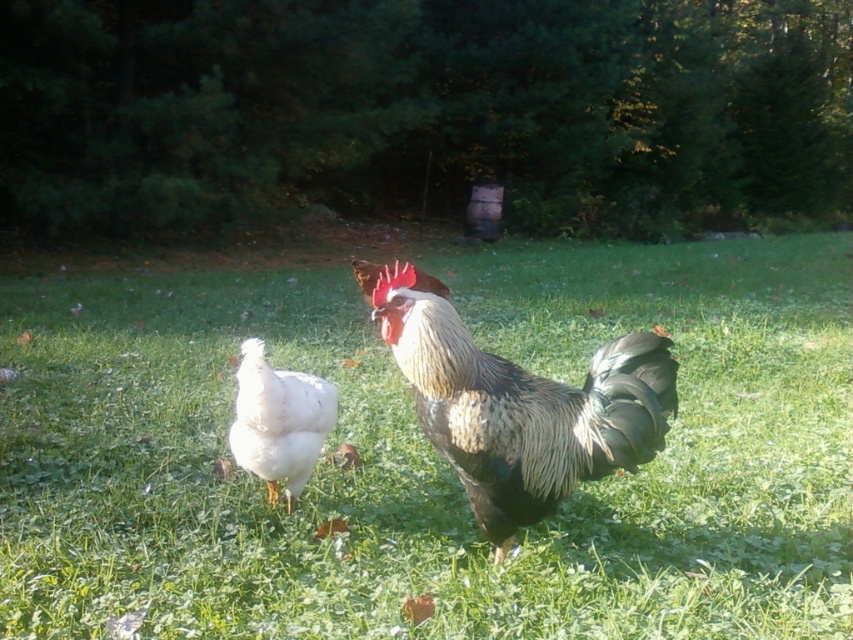
Does green grassy at center appear over black and white feathered rooster at center?

Incorrect, green grassy at center is not positioned above black and white feathered rooster at center.

Can you confirm if green grassy at center is bigger than black and white feathered rooster at center?

No, green grassy at center is not bigger than black and white feathered rooster at center.

What do you see at coordinates (428, 454) in the screenshot? I see `green grassy at center` at bounding box center [428, 454].

Locate an element on the screen. green grassy at center is located at coordinates (428, 454).

Between green grassy at center and white feathered chicken at center, which one is positioned lower?

Positioned lower is green grassy at center.

Is point (805, 440) closer to viewer compared to point (277, 464)?

That is False.

Between point (833, 269) and point (303, 483), which one is positioned in front?

Point (303, 483)

You are a GUI agent. You are given a task and a screenshot of the screen. Output one action in this format:
    pyautogui.click(x=<x>, y=<y>)
    Task: Click on the green grassy at center
    This screenshot has height=640, width=853.
    Given the screenshot: What is the action you would take?
    pyautogui.click(x=428, y=454)

Between black and white feathered rooster at center and white feathered chicken at center, which one appears on the left side from the viewer's perspective?

Positioned to the left is white feathered chicken at center.

Consider the image. Measure the distance between black and white feathered rooster at center and camera.

The distance of black and white feathered rooster at center from camera is 5.11 feet.

Is point (561, 426) closer to camera compared to point (250, 420)?

Yes, it is.

This screenshot has width=853, height=640. Identify the location of black and white feathered rooster at center. (521, 408).